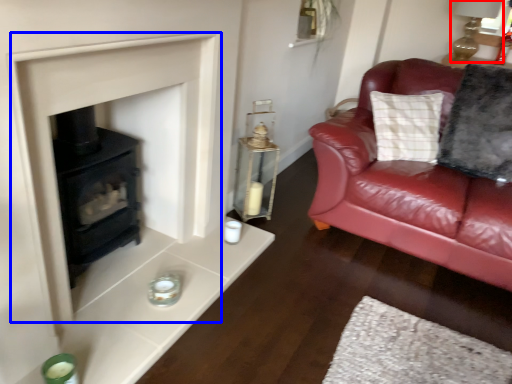
Question: Which point is closer to the camera, oil lamp (highlighted by a red box) or fireplace (highlighted by a blue box)?

Choices:
 (A) oil lamp
 (B) fireplace

Answer: (B)